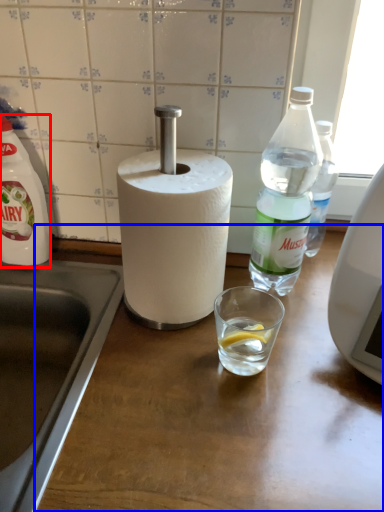
Question: Which object is further to the camera taking this photo, bottle (highlighted by a red box) or counter top (highlighted by a blue box)?

Choices:
 (A) bottle
 (B) counter top

Answer: (A)